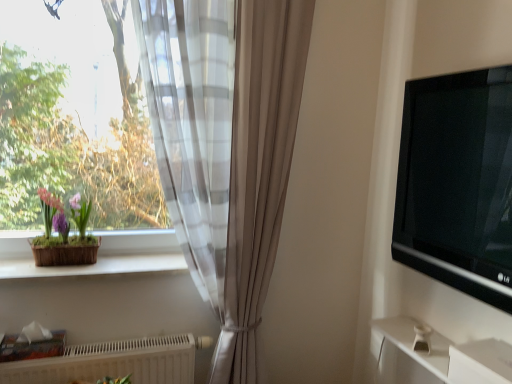
This screenshot has width=512, height=384. What do you see at coordinates (75, 115) in the screenshot? I see `translucent glass window at left` at bounding box center [75, 115].

What do you see at coordinates (458, 183) in the screenshot? The height and width of the screenshot is (384, 512). I see `black glossy tv at right` at bounding box center [458, 183].

Describe the element at coordinates (64, 233) in the screenshot. I see `matte brown pot at left` at that location.

The image size is (512, 384). Identify the location of white plastic drawer at lower right. (481, 362).

Considering the relative positions of sheer white curtain at left and black glossy tv at right in the image provided, is sheer white curtain at left in front of black glossy tv at right?

No, sheer white curtain at left is behind black glossy tv at right.

From a real-world perspective, is sheer white curtain at left physically below black glossy tv at right?

Yes, from a real-world perspective, sheer white curtain at left is below black glossy tv at right.

Does sheer white curtain at left have a greater height compared to black glossy tv at right?

Indeed, sheer white curtain at left has a greater height compared to black glossy tv at right.

Is black glossy tv at right not close to matte brown pot at left?

That's right, there is a large distance between black glossy tv at right and matte brown pot at left.

How many degrees apart are the facing directions of black glossy tv at right and matte brown pot at left?

The facing directions of black glossy tv at right and matte brown pot at left are 90 degrees apart.

Who is smaller, black glossy tv at right or matte brown pot at left?

matte brown pot at left is smaller.

From the image's perspective, would you say black glossy tv at right is positioned over sheer white curtain at left?

Yes, from the image's perspective, black glossy tv at right is on top of sheer white curtain at left.

Based on the photo, does black glossy tv at right contain sheer white curtain at left?

Definitely not — sheer white curtain at left is not inside black glossy tv at right.

Is black glossy tv at right at the right side of sheer white curtain at left?

Yes, black glossy tv at right is to the right of sheer white curtain at left.

Which is in front, point (410, 259) or point (209, 133)?

The point (410, 259) is closer.

Is white smooth window sill at lower left in front of or behind matte brown pot at left in the image?

white smooth window sill at lower left is in front of matte brown pot at left.

From the image's perspective, is white smooth window sill at lower left positioned above or below matte brown pot at left?

white smooth window sill at lower left is below matte brown pot at left.

Is white smooth window sill at lower left in contact with matte brown pot at left?

white smooth window sill at lower left and matte brown pot at left are clearly separated.

Locate an element on the screen. This screenshot has width=512, height=384. houseplant below the translucent glass window at left (from the image's perspective) is located at coordinates (64, 233).

From a real-world perspective, is translucent glass window at left physically located above or below matte brown pot at left?

translucent glass window at left is situated higher than matte brown pot at left in the real world.

Which object is further away from the camera, translucent glass window at left or matte brown pot at left?

matte brown pot at left is further away from the camera.

From the image's perspective, is translucent glass window at left positioned above or below matte brown pot at left?

translucent glass window at left is above matte brown pot at left.

Is black glossy tv at right positioned beyond the bounds of translucent glass window at left?

Yes, black glossy tv at right is outside of translucent glass window at left.

Could you tell me if black glossy tv at right is facing translucent glass window at left?

No, black glossy tv at right does not turn towards translucent glass window at left.

How different are the orientations of black glossy tv at right and translucent glass window at left in degrees?

90 degrees.

Is black glossy tv at right thinner than translucent glass window at left?

Indeed, black glossy tv at right has a lesser width compared to translucent glass window at left.

Considering the relative positions of white textured radiator at lower left and matte brown pot at left in the image provided, is white textured radiator at lower left behind matte brown pot at left?

No.

Looking at the image, does white textured radiator at lower left seem bigger or smaller compared to matte brown pot at left?

Clearly, white textured radiator at lower left is larger in size than matte brown pot at left.

Can you tell me how much white textured radiator at lower left and matte brown pot at left differ in facing direction?

0.0866 degrees separate the facing orientations of white textured radiator at lower left and matte brown pot at left.

From a real-world perspective, is white textured radiator at lower left positioned over matte brown pot at left based on gravity?

No.

Where is `curtain that is on the left side of black glossy tv at right`? The image size is (512, 384). curtain that is on the left side of black glossy tv at right is located at coordinates (226, 146).

Find the location of a particular element. This screenshot has width=512, height=384. houseplant behind the black glossy tv at right is located at coordinates (64, 233).

Looking at this image, which object lies nearer to the anchor point matte brown pot at left, white textured radiator at lower left or sheer white curtain at left?

white textured radiator at lower left.

Estimate the real-world distances between objects in this image. Which object is further from white plastic drawer at lower right, white smooth window sill at lower left or white textured radiator at lower left?

Based on the image, white smooth window sill at lower left appears to be further to white plastic drawer at lower right.

From the image, which object appears to be nearer to black glossy tv at right, white smooth window sill at lower left or sheer white curtain at left?

sheer white curtain at left is positioned closer to the anchor black glossy tv at right.

From the image, which object appears to be farther from sheer white curtain at left, translucent glass window at left or matte brown pot at left?

matte brown pot at left is positioned further to the anchor sheer white curtain at left.

From the image, which object appears to be farther from sheer white curtain at left, translucent glass window at left or white textured radiator at lower left?

white textured radiator at lower left is further to sheer white curtain at left.

Estimate the real-world distances between objects in this image. Which object is further from white smooth window sill at lower left, sheer white curtain at left or matte brown pot at left?

The object further to white smooth window sill at lower left is sheer white curtain at left.

From the image, which object appears to be farther from matte brown pot at left, sheer white curtain at left or black glossy tv at right?

black glossy tv at right is further to matte brown pot at left.

Looking at this image, based on their spatial positions, is white smooth window sill at lower left or white textured radiator at lower left closer to black glossy tv at right?

white smooth window sill at lower left is closer to black glossy tv at right.

Locate an element on the screen. The height and width of the screenshot is (384, 512). houseplant between sheer white curtain at left and white textured radiator at lower left in the up-down direction is located at coordinates (64, 233).

Find the location of a particular element. The width and height of the screenshot is (512, 384). window sill between sheer white curtain at left and white textured radiator at lower left in the vertical direction is located at coordinates (95, 266).

You are a GUI agent. You are given a task and a screenshot of the screen. Output one action in this format:
    pyautogui.click(x=<x>, y=<y>)
    Task: Click on the window sill between matte brown pot at left and white textured radiator at lower left vertically
    This screenshot has height=384, width=512.
    Given the screenshot: What is the action you would take?
    pos(95,266)

The height and width of the screenshot is (384, 512). Find the location of `window located between white smooth window sill at lower left and sheer white curtain at left in the left-right direction`. window located between white smooth window sill at lower left and sheer white curtain at left in the left-right direction is located at coordinates (75, 115).